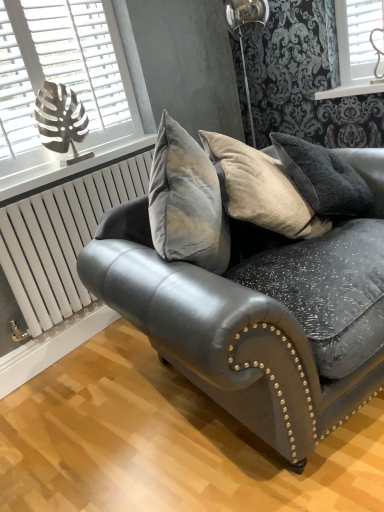
Question: From a real-world perspective, is velvet grey couch at center physically above white metallic radiator at lower left?

Choices:
 (A) yes
 (B) no

Answer: (B)

Question: Does velvet grey couch at center have a lesser width compared to white metallic radiator at lower left?

Choices:
 (A) no
 (B) yes

Answer: (A)

Question: Does velvet grey couch at center have a greater width compared to white metallic radiator at lower left?

Choices:
 (A) no
 (B) yes

Answer: (B)

Question: Is velvet grey couch at center at the right side of white metallic radiator at lower left?

Choices:
 (A) yes
 (B) no

Answer: (A)

Question: Is velvet grey couch at center bigger than white metallic radiator at lower left?

Choices:
 (A) yes
 (B) no

Answer: (A)

Question: Considering the positions of white painted wood at upper center and metallic silver leaf at upper left in the image, is white painted wood at upper center wider or thinner than metallic silver leaf at upper left?

Choices:
 (A) thin
 (B) wide

Answer: (B)

Question: In terms of size, does white painted wood at upper center appear bigger or smaller than metallic silver leaf at upper left?

Choices:
 (A) big
 (B) small

Answer: (B)

Question: Considering their positions, is white painted wood at upper center located in front of or behind metallic silver leaf at upper left?

Choices:
 (A) behind
 (B) front

Answer: (A)

Question: From a real-world perspective, relative to metallic silver leaf at upper left, is white painted wood at upper center vertically above or below?

Choices:
 (A) below
 (B) above

Answer: (A)

Question: In the image, is white painted wood at upper center positioned in front of or behind velvet grey couch at center?

Choices:
 (A) front
 (B) behind

Answer: (B)

Question: From their relative heights in the image, would you say white painted wood at upper center is taller or shorter than velvet grey couch at center?

Choices:
 (A) short
 (B) tall

Answer: (A)

Question: Is white painted wood at upper center situated inside velvet grey couch at center or outside?

Choices:
 (A) outside
 (B) inside

Answer: (A)

Question: Is white painted wood at upper center bigger or smaller than velvet grey couch at center?

Choices:
 (A) big
 (B) small

Answer: (B)

Question: In the image, is metallic silver leaf at upper left positioned in front of or behind velvet grey couch at center?

Choices:
 (A) behind
 (B) front

Answer: (A)

Question: Is metallic silver leaf at upper left bigger or smaller than velvet grey couch at center?

Choices:
 (A) big
 (B) small

Answer: (B)